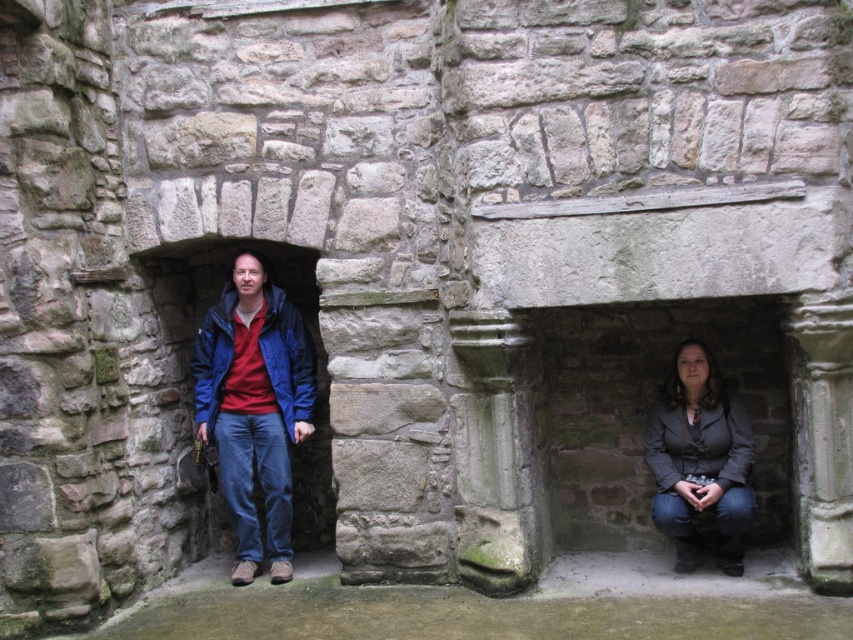
Question: Which of these objects is positioned farthest from the blue fabric jacket at center?

Choices:
 (A) dark gray matte jacket at lower right
 (B) dark gray textured jacket at lower right

Answer: (B)

Question: Is dark gray textured jacket at lower right further to the viewer compared to blue fabric jacket at center?

Choices:
 (A) yes
 (B) no

Answer: (B)

Question: Which of the following is the closest to the observer?

Choices:
 (A) dark gray matte jacket at lower right
 (B) blue fabric jacket at center
 (C) dark gray textured jacket at lower right

Answer: (C)

Question: Can you confirm if dark gray textured jacket at lower right is thinner than dark gray matte jacket at lower right?

Choices:
 (A) no
 (B) yes

Answer: (A)

Question: Estimate the real-world distances between objects in this image. Which object is farther from the dark gray textured jacket at lower right?

Choices:
 (A) blue fabric jacket at center
 (B) dark gray matte jacket at lower right

Answer: (A)

Question: Is dark gray textured jacket at lower right to the right of dark gray matte jacket at lower right from the viewer's perspective?

Choices:
 (A) yes
 (B) no

Answer: (B)